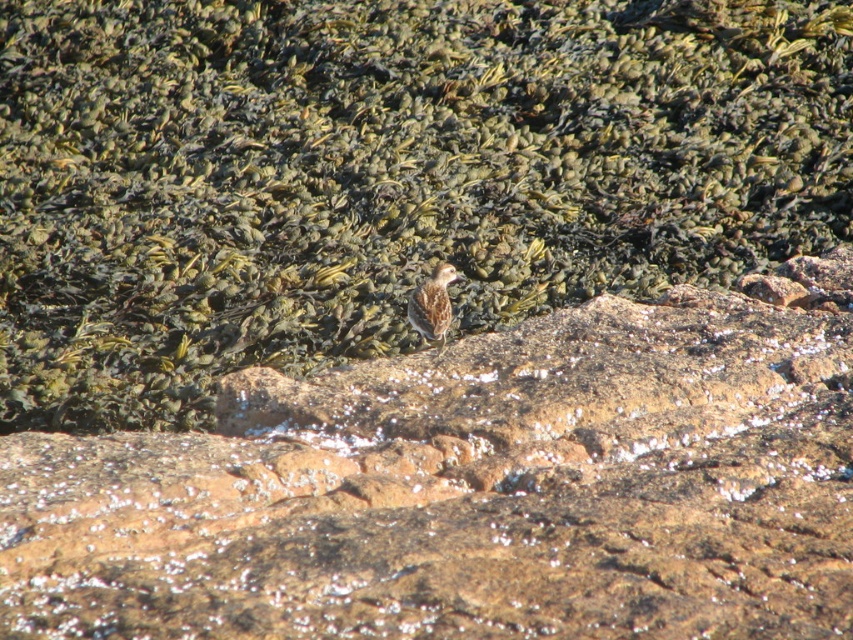
You are a birdwatcher observing the scene. You notice the brown textured rock at center and the brown speckled feather at center. Which object is positioned higher in the image?

The brown textured rock at center is located above the brown speckled feather at center, so it is positioned higher in the image.

Based on the photo, you are a bird with a wingspan of 3 feet. You are currently perched on the brown textured rock at center and want to fly to the brown rock at center. Can you reach the destination without flapping your wings? Please explain your reasoning based on the distance between the two rocks.

The brown textured rock at center is 18.75 feet away from the brown rock at center. Since your wingspan is 3 feet, you cannot glide that distance without flapping your wings. You would need to flap your wings to maintain flight over such a long distance.